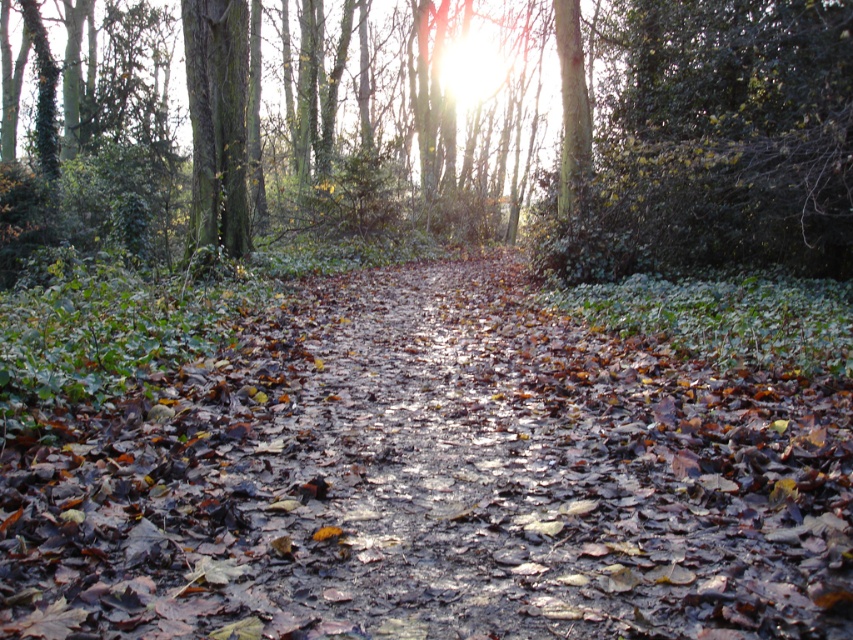
You are a hiker carrying a 1.5 meter wide tent. You need to set up camp between the green rough bark tree at center and the green mossy tree trunk at left. Can the space between them accommodate your tent?

The space between the green rough bark tree at center and the green mossy tree trunk at left is wider than 1.5 meters since the green rough bark tree at center is wider than the green mossy tree trunk at left. However, the description only mentions their widths, not the distance between them. Therefore, we cannot determine if the tent will fit based on the provided information.

You are a hiker walking along the forest path. You see the green rough bark tree at center and the green mossy tree trunk at left. Which tree is positioned more to your left side?

The green mossy tree trunk at left is positioned more to the left side because the green rough bark tree at center is to the left of it.